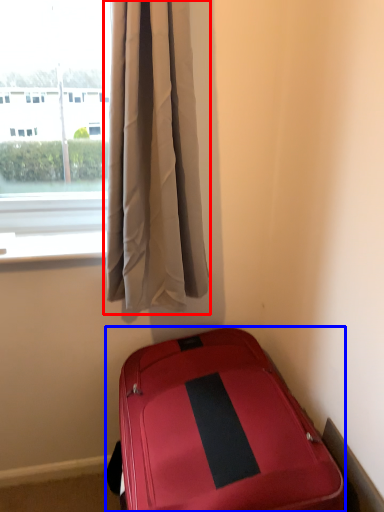
Question: Which of the following is the closest to the observer, curtain (highlighted by a red box) or suitcase (highlighted by a blue box)?

Choices:
 (A) curtain
 (B) suitcase

Answer: (B)